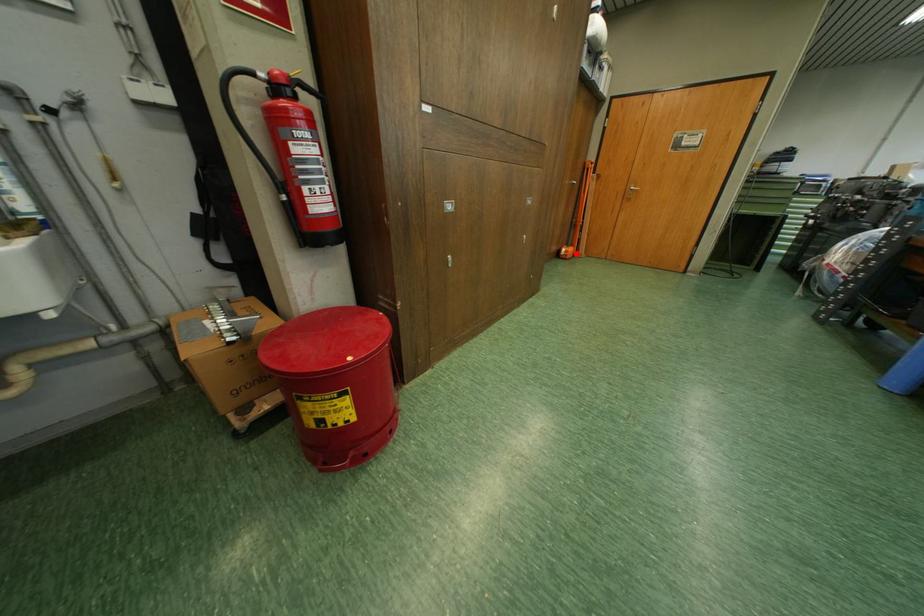
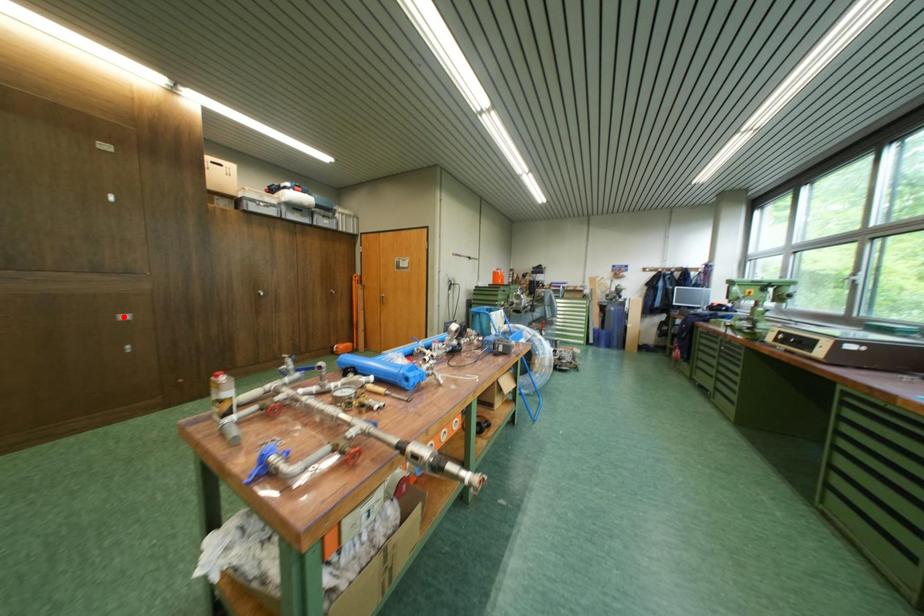
I am providing you with two images of the same scene from different viewpoints. A red point is marked on the first image and another point is marked on the second image. Is the marked point in image1 the same physical position as the marked point in image2?

No